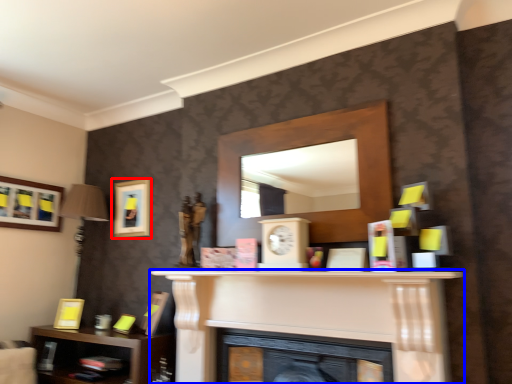
Question: Which of the following is the closest to the observer, picture frame (highlighted by a red box) or fireplace (highlighted by a blue box)?

Choices:
 (A) picture frame
 (B) fireplace

Answer: (B)